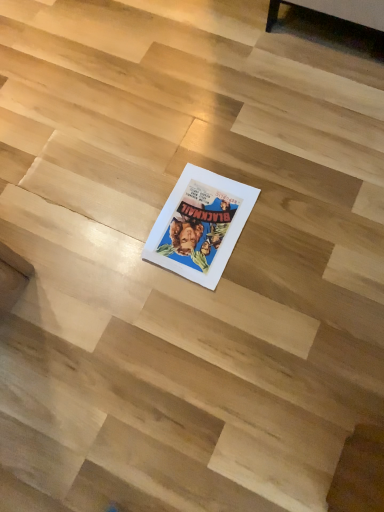
You are a GUI agent. You are given a task and a screenshot of the screen. Output one action in this format:
    pyautogui.click(x=<x>, y=<y>)
    Task: Click on the free spot above white paper book at center (from a real-world perspective)
    This screenshot has width=384, height=512.
    Given the screenshot: What is the action you would take?
    pyautogui.click(x=198, y=222)